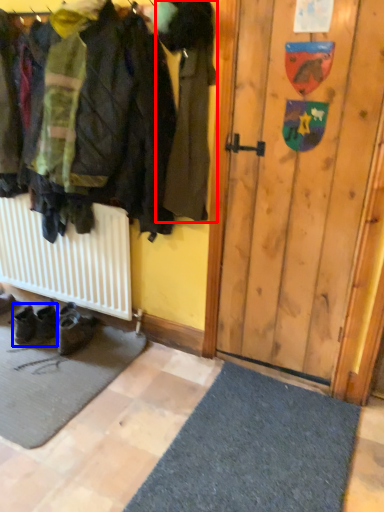
Question: Which object appears closest to the camera in this image, jacket (highlighted by a red box) or footwear (highlighted by a blue box)?

Choices:
 (A) jacket
 (B) footwear

Answer: (A)